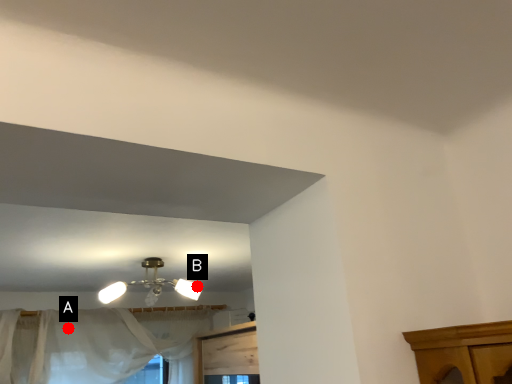
Question: Two points are circled on the image, labeled by A and B beside each circle. Which point is closer to the camera taking this photo?

Choices:
 (A) A is closer
 (B) B is closer

Answer: (B)